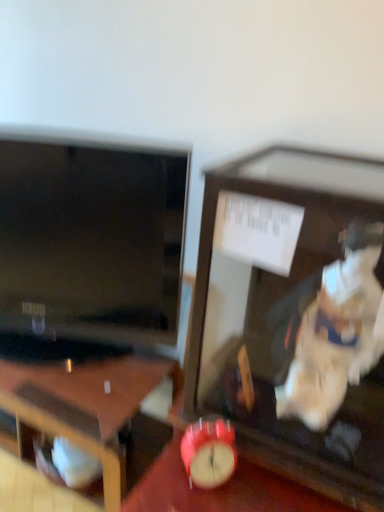
You are a GUI agent. You are given a task and a screenshot of the screen. Output one action in this format:
    pyautogui.click(x=<x>, y=<y>)
    Task: Click on the vacant region to the right of matte red alarm clock at lower right
    The height and width of the screenshot is (512, 384).
    Given the screenshot: What is the action you would take?
    pyautogui.click(x=271, y=482)